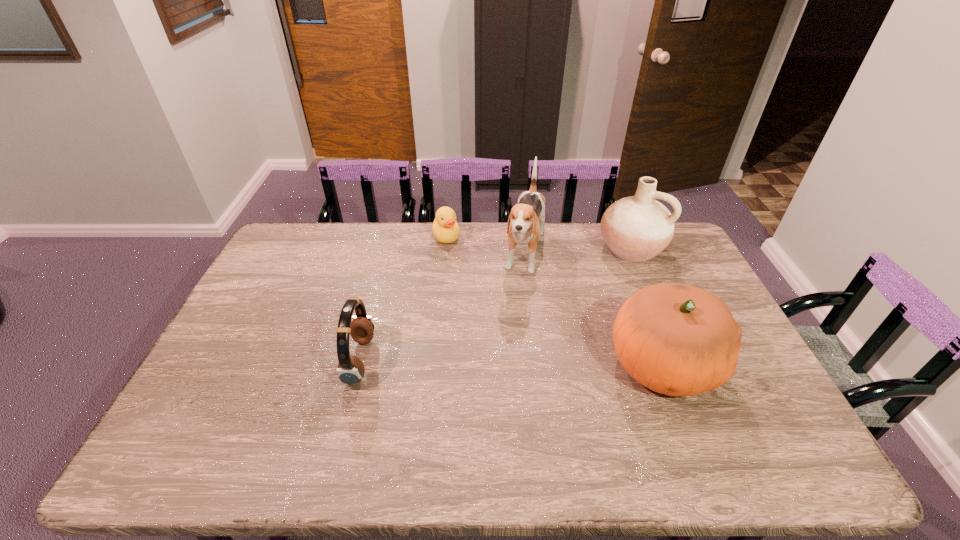
Find the location of `the leftmost object`. the leftmost object is located at coordinates (350, 370).

The width and height of the screenshot is (960, 540). What are the coordinates of `headset` in the screenshot? It's located at (350, 370).

The height and width of the screenshot is (540, 960). Find the location of `pumpkin`. pumpkin is located at coordinates (679, 340).

At what (x,y) coordinates should I click in order to perform the action: click on the fourth object from right to left. Please return your answer as a coordinate pair (x, y). The height and width of the screenshot is (540, 960). Looking at the image, I should click on (445, 228).

This screenshot has width=960, height=540. I want to click on the shortest object, so click(x=445, y=228).

Identify the location of pottery. (637, 228).

Where is `the third object from left to right`? the third object from left to right is located at coordinates (526, 221).

Locate an element on the screen. Image resolution: width=960 pixels, height=540 pixels. vacant space situated on the ear cup of the leftmost object is located at coordinates (472, 360).

Locate an element on the screen. This screenshot has height=540, width=960. blank space located 0.370m at the beak of the duck is located at coordinates (464, 319).

Where is `vacant area situated 0.330m at the beak of the duck`? This screenshot has height=540, width=960. vacant area situated 0.330m at the beak of the duck is located at coordinates (462, 310).